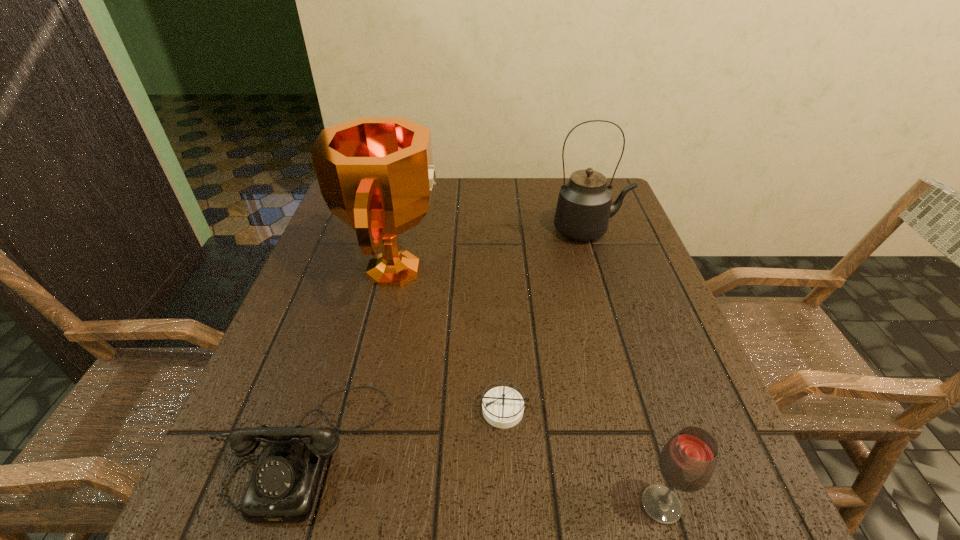
Locate an element on the screen. This screenshot has height=540, width=960. award is located at coordinates (376, 174).

I want to click on kettle, so click(x=584, y=206).

Locate an element on the screen. This screenshot has width=960, height=540. glass drink container is located at coordinates (687, 462).

Locate an element on the screen. Image resolution: width=960 pixels, height=540 pixels. the second shortest object is located at coordinates (283, 487).

The image size is (960, 540). I want to click on the shortest object, so click(x=503, y=407).

Where is `the third object from right to left`? The height and width of the screenshot is (540, 960). the third object from right to left is located at coordinates (503, 407).

Image resolution: width=960 pixels, height=540 pixels. Find the location of `free space located on the side of the award with the star emblem`. free space located on the side of the award with the star emblem is located at coordinates (537, 269).

The image size is (960, 540). I want to click on blank area located 0.110m on the right of the glass drink container, so coord(758,505).

I want to click on vacant space situated 0.090m on the front of the third object from left to right, so click(x=506, y=488).

Where is `object positioned at the far edge`? This screenshot has width=960, height=540. object positioned at the far edge is located at coordinates (584, 206).